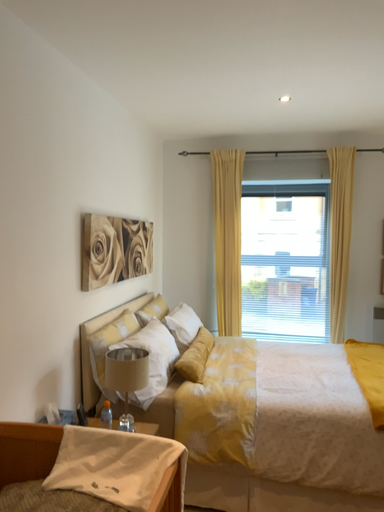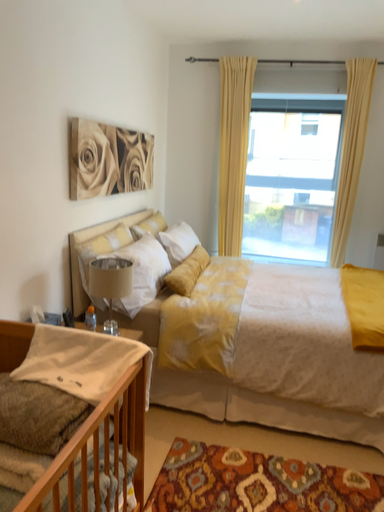
Question: How did the camera likely rotate when shooting the video?

Choices:
 (A) rotated upward
 (B) rotated downward

Answer: (B)